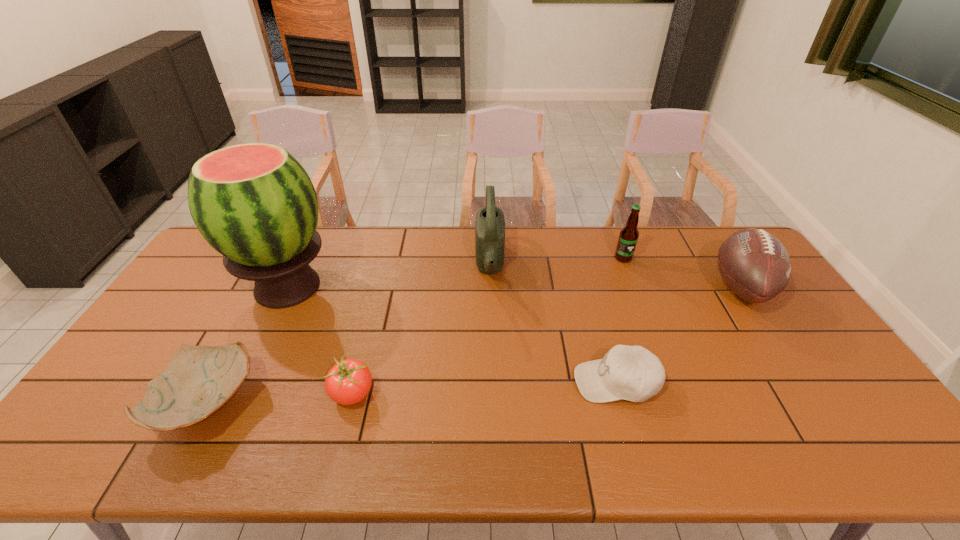
In order to click on watermelon in this screenshot , I will do `click(254, 203)`.

The height and width of the screenshot is (540, 960). Find the location of `the fourth object from left to right`. the fourth object from left to right is located at coordinates (490, 224).

Where is `beer bottle`? The width and height of the screenshot is (960, 540). beer bottle is located at coordinates (628, 237).

You are a GUI agent. You are given a task and a screenshot of the screen. Output one action in this format:
    pyautogui.click(x=<x>, y=<y>)
    Task: Click on the football (American)
    The width and height of the screenshot is (960, 540).
    Given the screenshot: What is the action you would take?
    pyautogui.click(x=755, y=265)

Find the location of a particular element. baseball cap is located at coordinates (632, 373).

Locate an element on the screen. The width and height of the screenshot is (960, 540). the fifth object from right to left is located at coordinates pyautogui.click(x=348, y=382).

Identify the location of pottery. This screenshot has width=960, height=540. (198, 380).

Locate an element on the screen. free space located 0.210m on the right of the tallest object is located at coordinates (402, 287).

You are a GUI agent. You are given a task and a screenshot of the screen. Output one action in this format:
    pyautogui.click(x=<x>, y=<y>)
    Task: Click on the free location located on the spout of the watering can
    
    Given the screenshot: What is the action you would take?
    pyautogui.click(x=379, y=265)

Locate an element on the screen. The height and width of the screenshot is (540, 960). blank space located on the spout of the watering can is located at coordinates (359, 265).